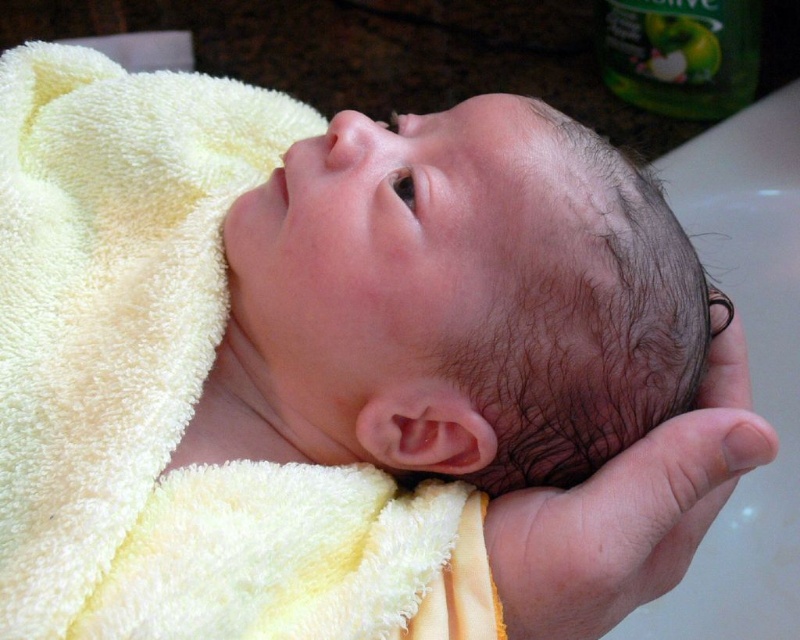
Does point (386, 323) lie in front of point (488, 525)?

Yes, point (386, 323) is in front of point (488, 525).

The width and height of the screenshot is (800, 640). What do you see at coordinates (458, 300) in the screenshot?
I see `smooth skin head at center` at bounding box center [458, 300].

Where is `smooth skin head at center`? Image resolution: width=800 pixels, height=640 pixels. smooth skin head at center is located at coordinates (458, 300).